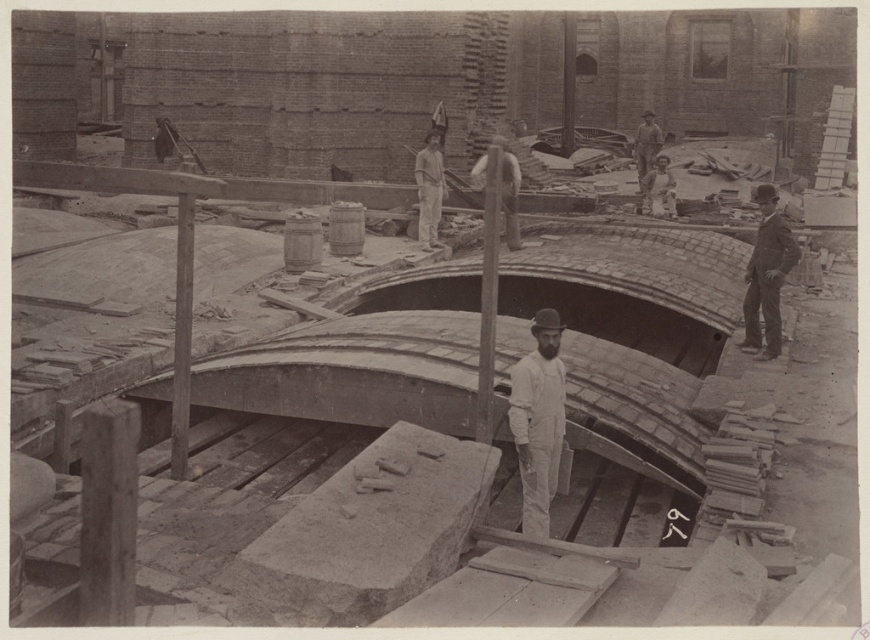
You are a safety inspector at this construction site. You need to ensure that the smooth black suit at right and the smooth white shirt at center are maintaining a safe distance of at least 20 feet apart for safety protocols. Are they following the safety guidelines?

The distance between the smooth black suit at right and the smooth white shirt at center is 18.53 feet, which is less than the required 20 feet. They are not following the safety guidelines.

You are an observer standing at the back of the construction site. You notice two men in the scene. One is wearing a smooth black suit at right and the other is wearing a smooth white shirt at center. Which man is positioned closer to the ground?

The smooth black suit at right is below smooth white shirt at center, so the man wearing the smooth black suit at right is positioned closer to the ground.